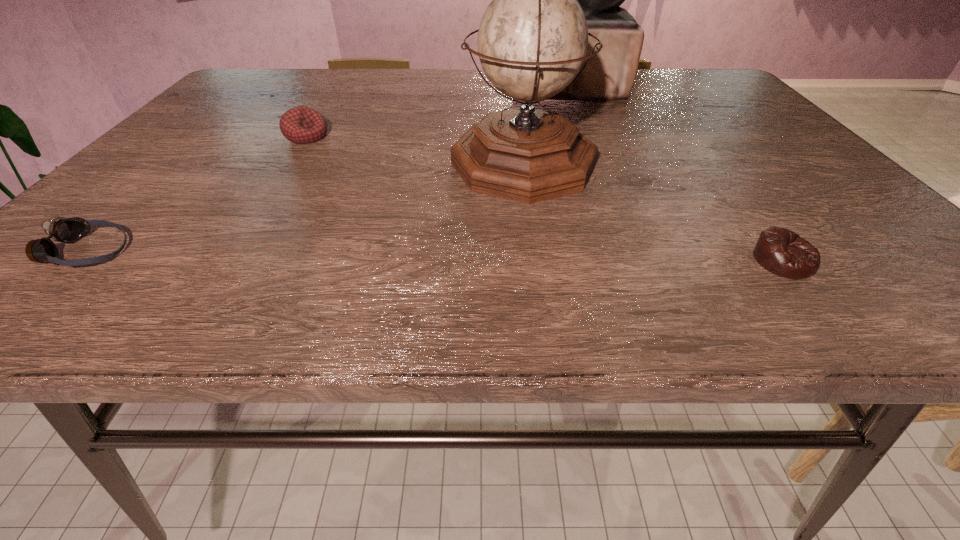
Locate an element on the screen. This screenshot has height=540, width=960. free space in the image that satisfies the following two spatial constraints: 1. on the back side of the shorter beanbag; 2. on the surface of the globe is located at coordinates (709, 164).

Locate an element on the screen. This screenshot has width=960, height=540. vacant region that satisfies the following two spatial constraints: 1. in a relaxed pose on the rightmost object; 2. on the left side of the tallest object is located at coordinates (642, 261).

The width and height of the screenshot is (960, 540). What are the coordinates of `free space that satisfies the following two spatial constraints: 1. in a relaxed pose on the farthest object; 2. on the front side of the fourth object from right to left` in the screenshot? It's located at (590, 136).

This screenshot has width=960, height=540. I want to click on vacant region that satisfies the following two spatial constraints: 1. on the surface of the right beanbag; 2. on the left side of the fourth shortest object, so click(x=538, y=261).